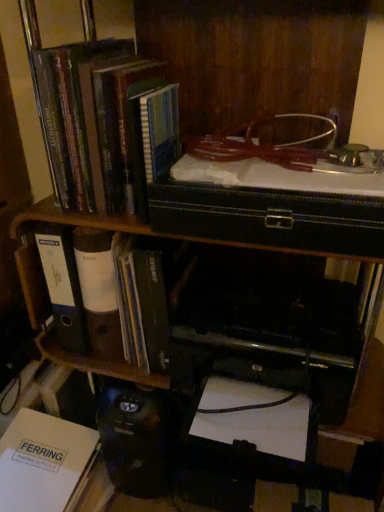
The image size is (384, 512). Find the location of `vacant space situated above white paper at lower left, positioned as the 3th book in top-to-bottom order (from a real-world perspective)`. vacant space situated above white paper at lower left, positioned as the 3th book in top-to-bottom order (from a real-world perspective) is located at coordinates (35, 448).